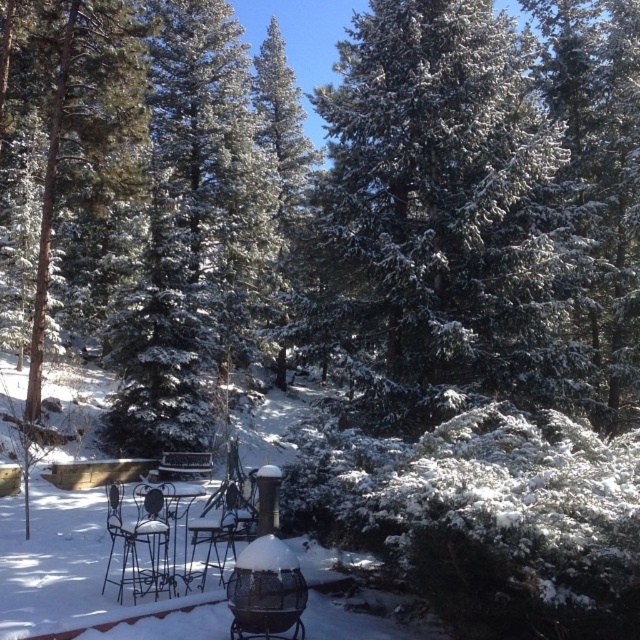
Question: Is black wrought iron chair at center closer to camera compared to metallic silver table at center?

Choices:
 (A) yes
 (B) no

Answer: (A)

Question: Is the position of snow-covered evergreen at center more distant than that of black wrought iron chair at center?

Choices:
 (A) yes
 (B) no

Answer: (A)

Question: Which is farther from the black wrought iron chair at center?

Choices:
 (A) metallic silver table at center
 (B) snow-covered evergreen at center

Answer: (B)

Question: Which object appears farthest from the camera in this image?

Choices:
 (A) snow-covered evergreen at center
 (B) metallic silver table at center
 (C) black wrought iron chair at center

Answer: (A)

Question: Which object is closer to the camera taking this photo?

Choices:
 (A) snow-covered evergreen at center
 (B) black wrought iron chair at center

Answer: (B)

Question: Is black wrought iron chair at center closer to the viewer compared to metallic silver table at center?

Choices:
 (A) yes
 (B) no

Answer: (A)